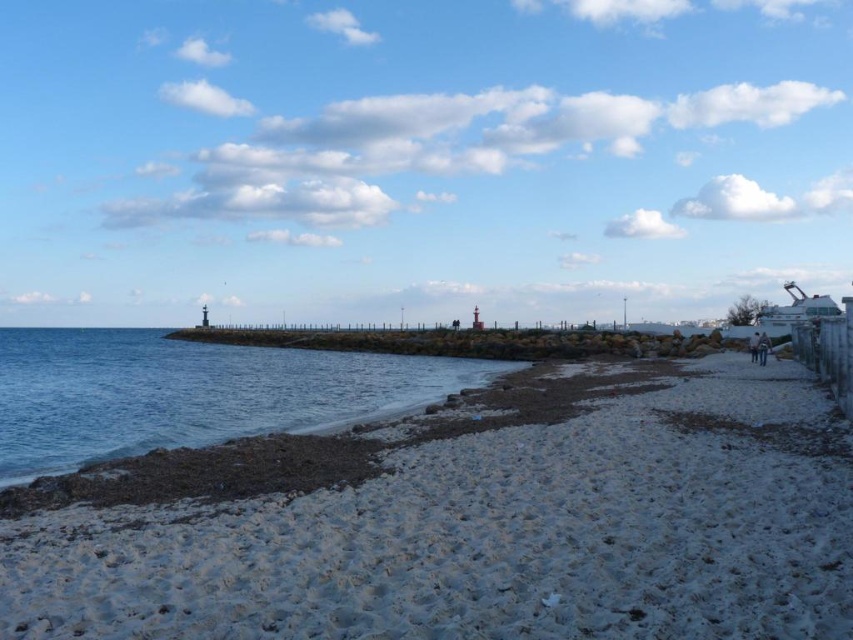
You are standing on the beach and see the blue water at lower left and the light brown leather jacket at lower right. Which object is positioned lower in the scene?

The blue water at lower left is positioned below the light brown leather jacket at lower right, so the blue water at lower left is lower in the scene.

You are standing on the beach and see the blue water at lower left and the dark blue jeans at lower right. Which object is positioned to the left of the other?

The blue water at lower left is to the left of dark blue jeans at lower right.